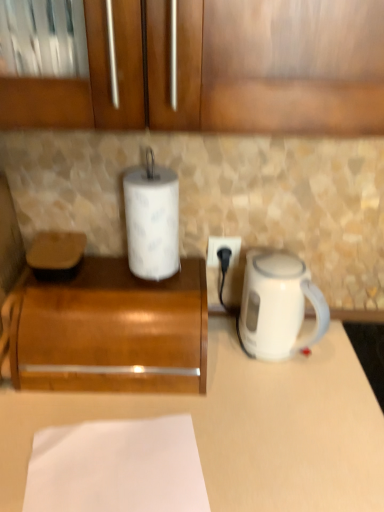
Where is `vacant area that is in front of white paper at center`? vacant area that is in front of white paper at center is located at coordinates (148, 295).